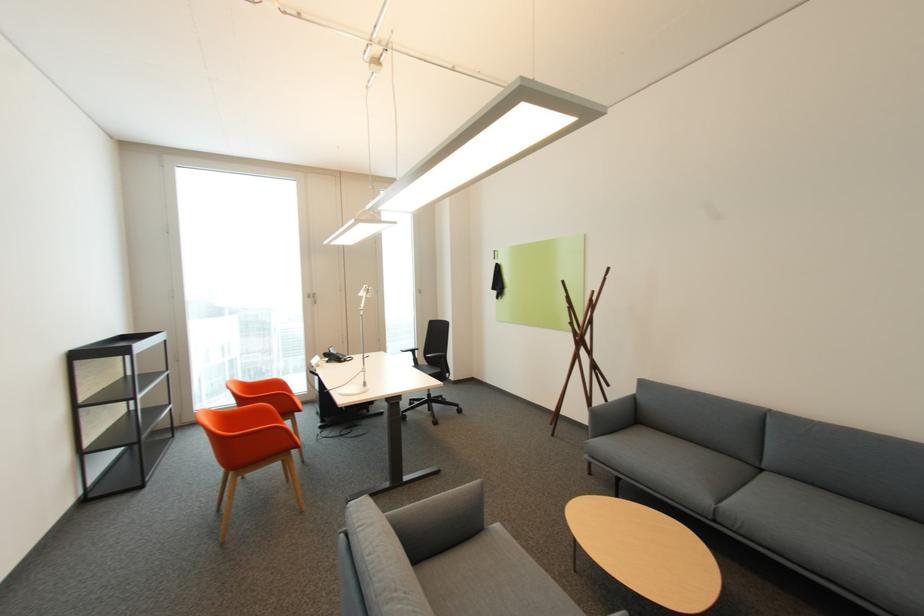
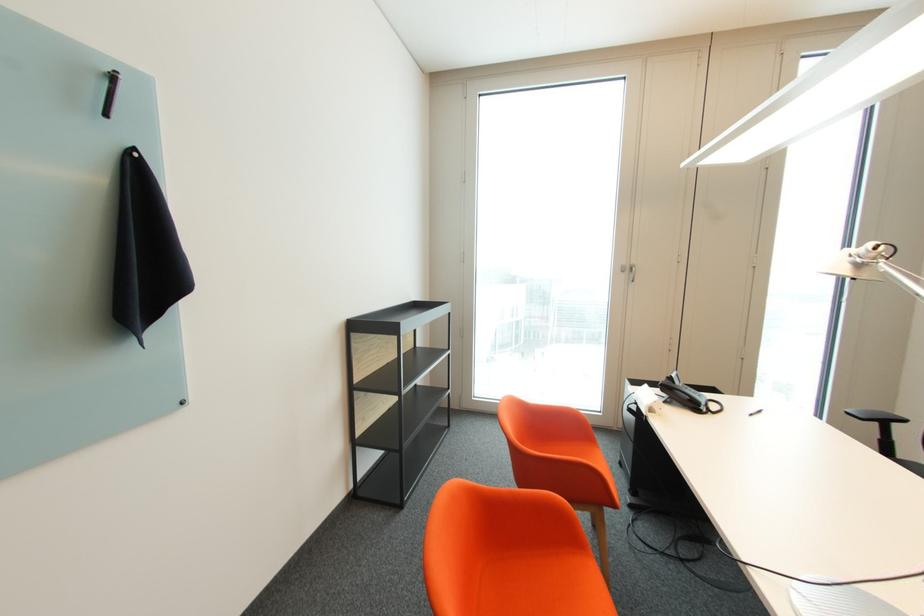
Find the pixel in the second image that matches the point at 314,297 in the first image.

(629, 272)